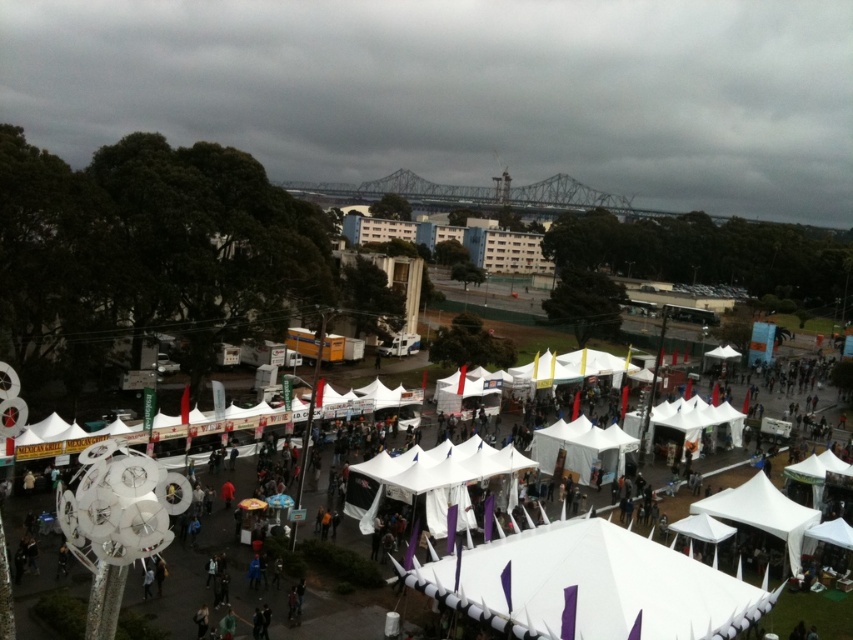
Locate an element on the screen. Image resolution: width=853 pixels, height=640 pixels. white fabric canopy at center is located at coordinates (590, 586).

Is white fabric canopy at center to the left of white fabric tent at lower right from the viewer's perspective?

Yes, white fabric canopy at center is to the left of white fabric tent at lower right.

Find the location of a particular element. The width and height of the screenshot is (853, 640). white fabric canopy at center is located at coordinates (590, 586).

At what (x,y) coordinates should I click in order to perform the action: click on white fabric canopy at center. Please return your answer as a coordinate pair (x, y). The width and height of the screenshot is (853, 640). Looking at the image, I should click on [590, 586].